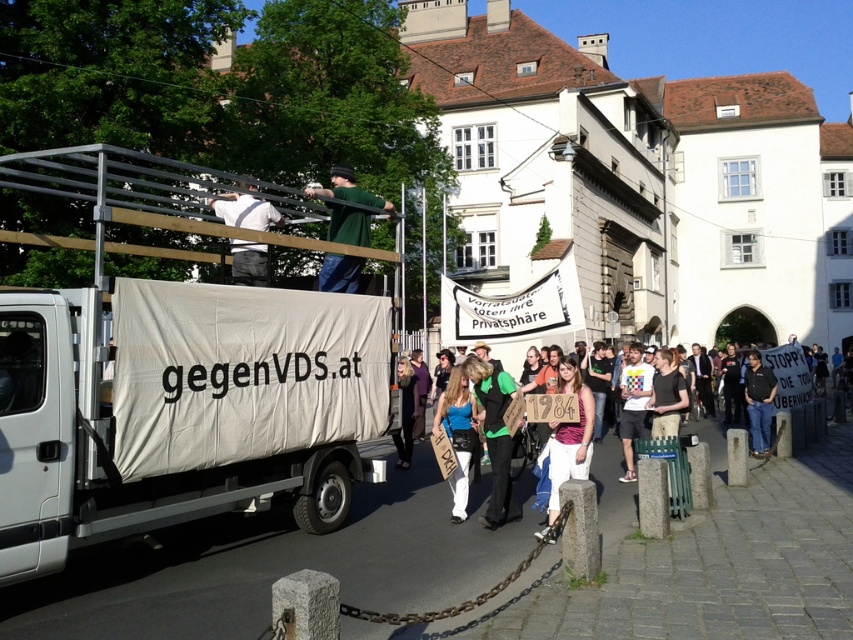
Is white fabric truck at upper left further to the viewer compared to dark blue shirt at center?

No, it is in front of dark blue shirt at center.

Between point (39, 477) and point (764, 403), which one is positioned behind?

Point (764, 403)

Where is `white fabric truck at upper left`? The width and height of the screenshot is (853, 640). white fabric truck at upper left is located at coordinates (173, 376).

This screenshot has height=640, width=853. I want to click on white fabric truck at upper left, so click(x=173, y=376).

Find the location of `white fabric truck at upper left`. white fabric truck at upper left is located at coordinates (173, 376).

Is green matte shirt at upper center positioned before white cotton shirt at center?

No, green matte shirt at upper center is further to the viewer.

Can you confirm if green matte shirt at upper center is wider than white cotton shirt at center?

Yes, green matte shirt at upper center is wider than white cotton shirt at center.

Where is `green matte shirt at upper center`? The height and width of the screenshot is (640, 853). green matte shirt at upper center is located at coordinates (347, 189).